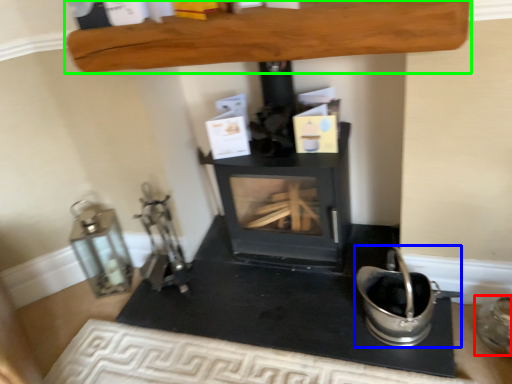
Question: Estimate the real-world distances between objects in this image. Which object is farther from appliance (highlighted by a red box), appliance (highlighted by a blue box) or furniture (highlighted by a green box)?

Choices:
 (A) appliance
 (B) furniture

Answer: (B)